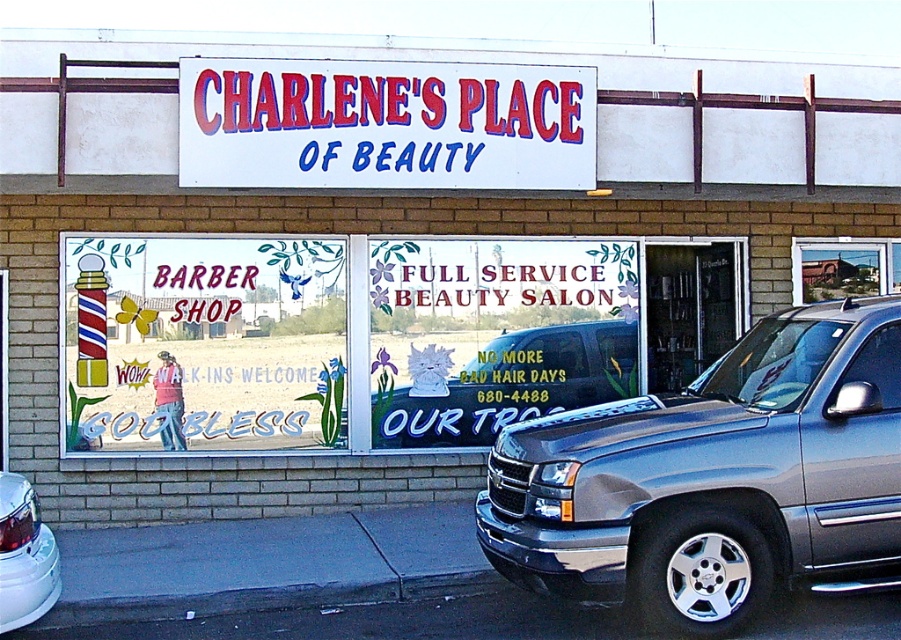
You are standing in front of the storefront of Charlene s Place of Beauty. You notice two points marked on the window. The first point is at coordinate point (810, 508) and the second is at point (37, 566). Which point is closer to you?

Point (37, 566) is closer to you because it is less further to the viewer than point (810, 508).

You are a customer driving a metallic silver car at center and want to park under the white plastic sign at center. Is there enough space for your car to fit under the sign?

The white plastic sign at center is positioned over metallic silver car at center, so yes, the car can park under the white plastic sign at center as the sign is above it.

You are a customer looking at the storefront of Charlene Beauty. You see a white plastic sign at center and a metallic silver car at center. Which object is wider?

The white plastic sign at center is wider than the metallic silver car at center.